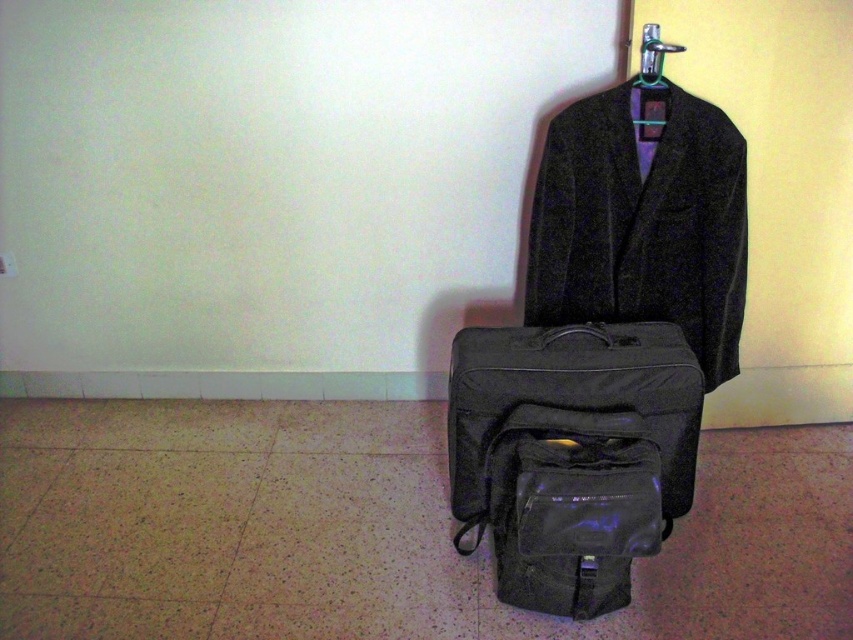
You are standing in the room and want to pick up the velvet black coat at upper center and the black fabric suitcase at center. Which object should you reach for first to grab both efficiently?

You should reach for the velvet black coat at upper center first since it is closer to you, allowing you to grab it before moving to the black fabric suitcase at center which is further away.

You are organizing a closet and need to decide whether the velvet black coat at upper center can be hung on the metallic silver hanger at upper center. Based on their sizes, can the coat be properly hung on the hanger?

The velvet black coat at upper center is larger in size than the metallic silver hanger at upper center, so the coat may not fit properly on the hanger due to its larger size.